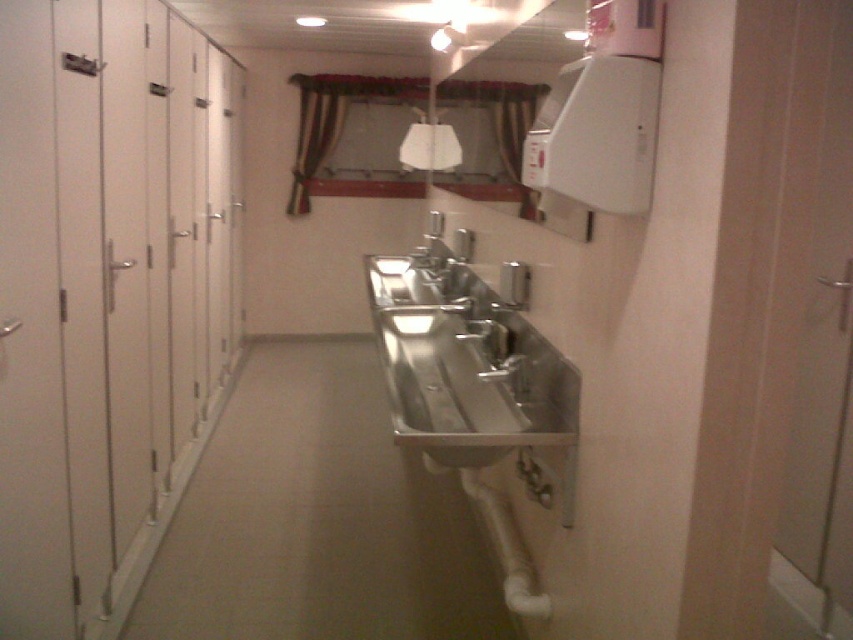
You are a maintenance worker in a public restroom and need to check the satin silver faucet at center. You are currently standing in front of the white matte lockers at left. Which direction should you move to reach the faucet?

Since the white matte lockers at left is positioned on the left side of the satin silver faucet at center, you should move to the right to reach the faucet.

You are a maintenance worker checking the restroom layout. You need to replace a locker that is positioned above the stainless steel sink at center. Which locker should you inspect first, the white matte lockers at left or another locker not mentioned?

The white matte lockers at left are above the stainless steel sink at center, so you should inspect the white matte lockers at left first.